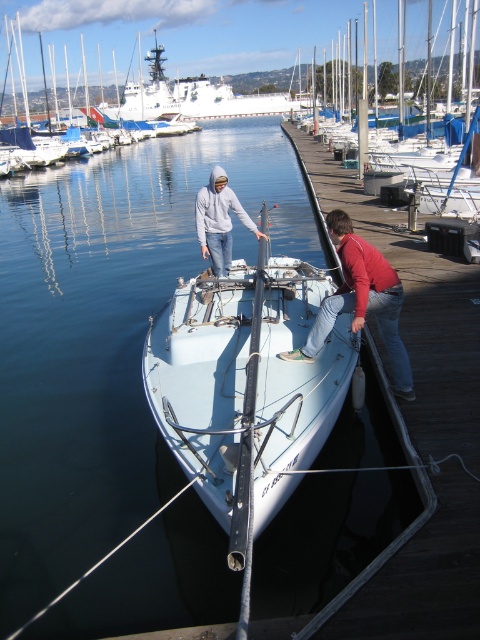
Question: Which point appears closest to the camera in this image?

Choices:
 (A) (226, 252)
 (B) (191, 476)
 (C) (33, 156)
 (D) (411, 396)

Answer: (B)

Question: Is white glossy sailboat at upper center smaller than light gray hoodie at center?

Choices:
 (A) no
 (B) yes

Answer: (A)

Question: Where is white matte sailboat at center located in relation to red cotton shirt at center in the image?

Choices:
 (A) above
 (B) below

Answer: (B)

Question: Considering the real-world distances, which object is farthest from the red cotton shirt at center?

Choices:
 (A) light gray hoodie at center
 (B) white matte sailboat at center
 (C) white glossy sailboat at upper center

Answer: (C)

Question: Which of the following is the farthest from the observer?

Choices:
 (A) white matte sailboat at center
 (B) light gray hoodie at center
 (C) white glossy sailboat at upper center
 (D) red cotton shirt at center

Answer: (C)

Question: Can you confirm if white glossy sailboat at upper center is bigger than light gray hoodie at center?

Choices:
 (A) no
 (B) yes

Answer: (B)